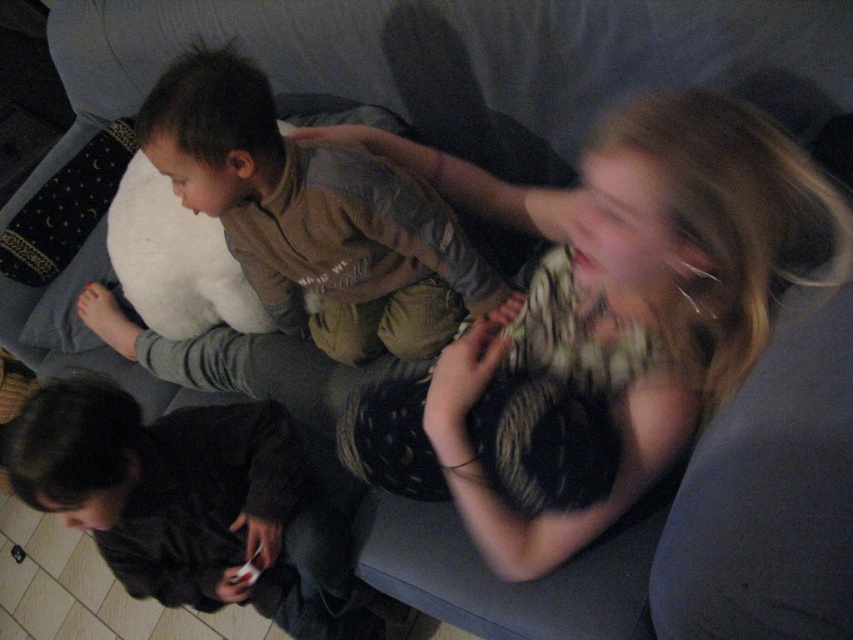
Question: Which object appears farthest from the camera in this image?

Choices:
 (A) brown cotton shirt at upper left
 (B) white matte game controller at lower left

Answer: (B)

Question: Which point appears farthest from the camera in this image?

Choices:
 (A) (247, 582)
 (B) (238, 177)

Answer: (A)

Question: Is brown cotton shirt at upper left to the right of white matte game controller at lower left from the viewer's perspective?

Choices:
 (A) no
 (B) yes

Answer: (B)

Question: Does brown cotton shirt at upper left appear on the left side of white matte game controller at lower left?

Choices:
 (A) yes
 (B) no

Answer: (B)

Question: Is brown cotton shirt at upper left thinner than white matte game controller at lower left?

Choices:
 (A) no
 (B) yes

Answer: (A)

Question: Which object is farther from the camera taking this photo?

Choices:
 (A) brown cotton shirt at upper left
 (B) white matte game controller at lower left

Answer: (B)